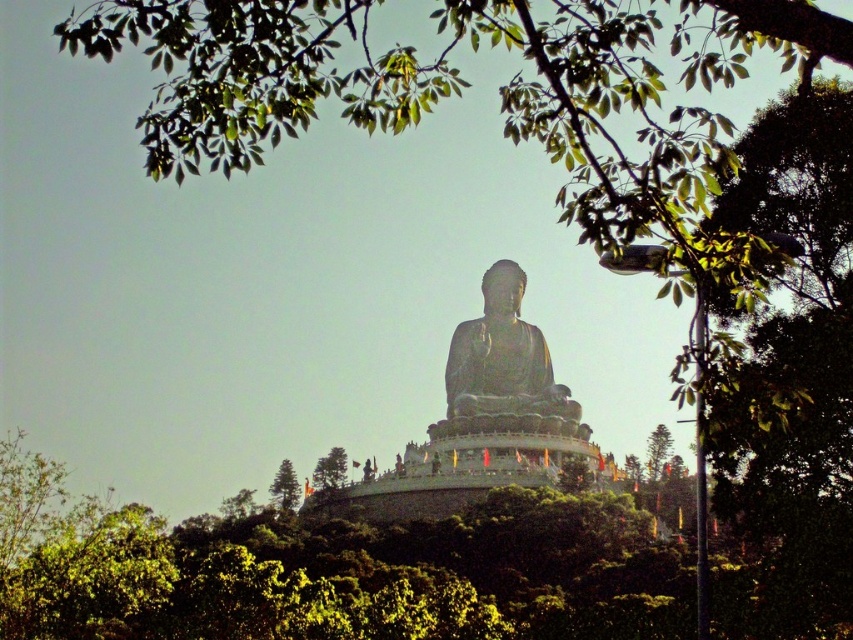
You are standing at point (329, 468) in the image. What object is located exactly at your current position?

The green leafy tree at center is located exactly at point (329, 468).